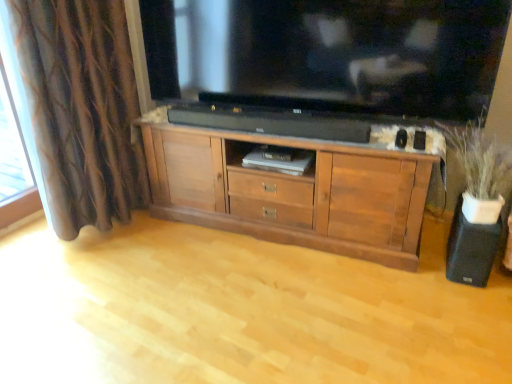
Question: Is brown textured curtain at left to the right of black matte speaker at lower right from the viewer's perspective?

Choices:
 (A) no
 (B) yes

Answer: (A)

Question: Is brown textured curtain at left bigger than black matte speaker at lower right?

Choices:
 (A) yes
 (B) no

Answer: (A)

Question: Can you confirm if brown textured curtain at left is positioned to the left of black matte speaker at lower right?

Choices:
 (A) yes
 (B) no

Answer: (A)

Question: Considering the relative sizes of brown textured curtain at left and black matte speaker at lower right in the image provided, is brown textured curtain at left smaller than black matte speaker at lower right?

Choices:
 (A) yes
 (B) no

Answer: (B)

Question: Is brown textured curtain at left further to the viewer compared to black matte speaker at lower right?

Choices:
 (A) no
 (B) yes

Answer: (A)

Question: Considering the relative positions of black glossy television at upper center and brown wood cabinet at center in the image provided, is black glossy television at upper center to the left or to the right of brown wood cabinet at center?

Choices:
 (A) left
 (B) right

Answer: (B)

Question: From a real-world perspective, relative to brown wood cabinet at center, is black glossy television at upper center vertically above or below?

Choices:
 (A) above
 (B) below

Answer: (A)

Question: Is black glossy television at upper center bigger or smaller than brown wood cabinet at center?

Choices:
 (A) small
 (B) big

Answer: (A)

Question: In terms of height, does black glossy television at upper center look taller or shorter compared to brown wood cabinet at center?

Choices:
 (A) tall
 (B) short

Answer: (B)

Question: Considering the positions of white matte vase at right and wooden cabinet at center in the image, is white matte vase at right taller or shorter than wooden cabinet at center?

Choices:
 (A) short
 (B) tall

Answer: (B)

Question: Would you say white matte vase at right is to the left or to the right of wooden cabinet at center in the picture?

Choices:
 (A) right
 (B) left

Answer: (A)

Question: Is white matte vase at right situated inside wooden cabinet at center or outside?

Choices:
 (A) inside
 (B) outside

Answer: (B)

Question: Is point (446, 140) positioned closer to the camera than point (360, 339)?

Choices:
 (A) closer
 (B) farther

Answer: (B)

Question: Considering the positions of point (357, 23) and point (287, 365), is point (357, 23) closer or farther from the camera than point (287, 365)?

Choices:
 (A) closer
 (B) farther

Answer: (B)

Question: Choose the correct answer: Is black glossy television at upper center inside wooden cabinet at center or outside it?

Choices:
 (A) inside
 (B) outside

Answer: (B)